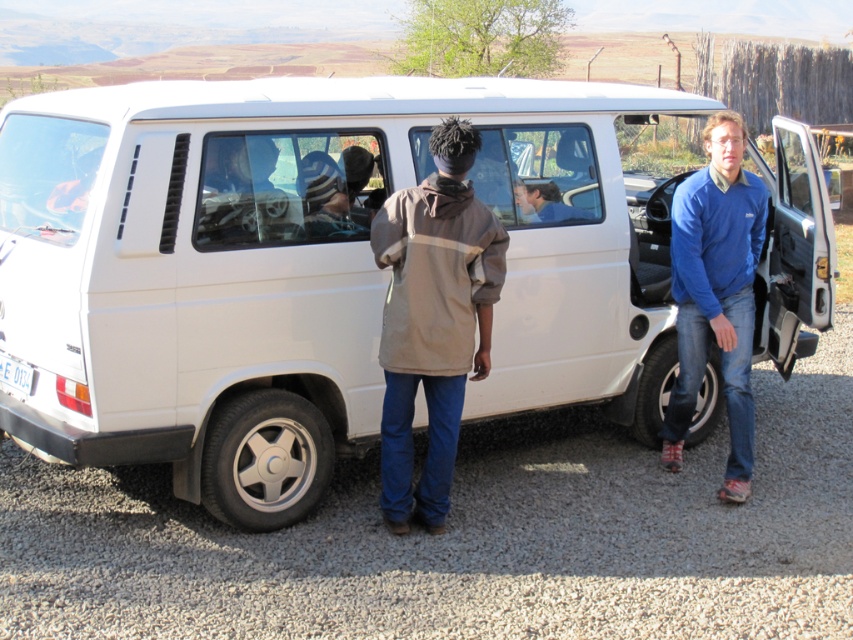
Is white matte van at center smaller than tan fabric jacket at center?

No, white matte van at center is not smaller than tan fabric jacket at center.

What do you see at coordinates (309, 268) in the screenshot?
I see `white matte van at center` at bounding box center [309, 268].

At what (x,y) coordinates should I click in order to perform the action: click on white matte van at center. Please return your answer as a coordinate pair (x, y). This screenshot has width=853, height=640. Looking at the image, I should click on (309, 268).

Is tan fabric jacket at center positioned in front of blue fleece jacket at right?

Answer: That is True.

Can you confirm if tan fabric jacket at center is wider than blue fleece jacket at right?

In fact, tan fabric jacket at center might be narrower than blue fleece jacket at right.

Locate an element on the screen. tan fabric jacket at center is located at coordinates (433, 317).

You are a GUI agent. You are given a task and a screenshot of the screen. Output one action in this format:
    pyautogui.click(x=<x>, y=<y>)
    Task: Click on the tan fabric jacket at center
    
    Given the screenshot: What is the action you would take?
    pyautogui.click(x=433, y=317)

Who is shorter, white matte van at center or blue fleece jacket at right?

blue fleece jacket at right

Image resolution: width=853 pixels, height=640 pixels. In order to click on white matte van at center in this screenshot , I will do `click(309, 268)`.